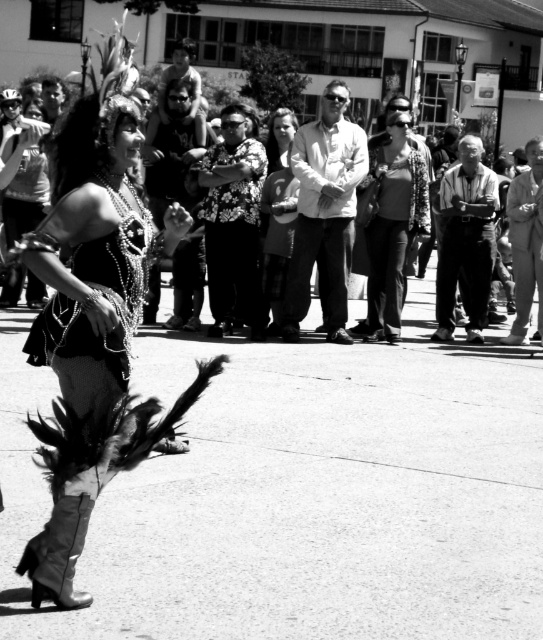
Question: Observing the image, what is the correct spatial positioning of shiny sequined dress at center in reference to floral shirt at center?

Choices:
 (A) left
 (B) right

Answer: (A)

Question: Which point is closer to the camera?

Choices:
 (A) floral shirt at center
 (B) bearded man with long hair at center
 (C) dark gray pants at center

Answer: (A)

Question: Is matte black clothing at center below white shirt at center?

Choices:
 (A) no
 (B) yes

Answer: (A)

Question: Does bearded man with long hair at center lie behind matte black dress at center?

Choices:
 (A) no
 (B) yes

Answer: (A)

Question: Based on their relative distances, which object is farther from the light beige cotton shirt at right?

Choices:
 (A) matte black clothing at center
 (B) dark gray pants at center

Answer: (A)

Question: Which point appears farthest from the camera in this image?

Choices:
 (A) (194, 51)
 (B) (331, 237)

Answer: (A)